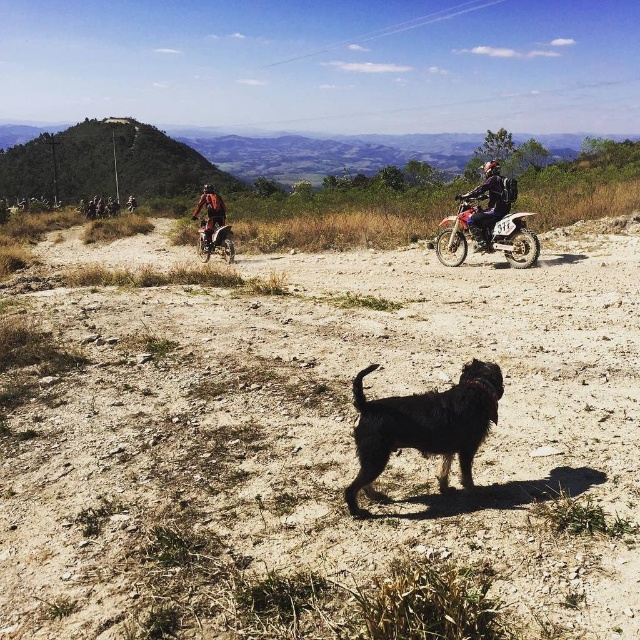
Between brown sandy dirt at center and green grassy hill at upper left, which one has more height?

green grassy hill at upper left is taller.

Is point (340, 554) positioned in front of point (1, 170)?

That is True.

Find the location of a particular element. brown sandy dirt at center is located at coordinates (321, 445).

Is metallic silver dirt bike at center-left wider than orange fabric jacket at upper left?

Yes, metallic silver dirt bike at center-left is wider than orange fabric jacket at upper left.

Who is shorter, metallic silver dirt bike at center-left or orange fabric jacket at upper left?

metallic silver dirt bike at center-left is shorter.

Between point (198, 248) and point (209, 227), which one is positioned in front?

Point (209, 227) is more forward.

Identify the location of metallic silver dirt bike at center-left. This screenshot has width=640, height=640. (214, 241).

Is orange matte dirt bike at right bigger than orange fabric jacket at upper left?

Indeed, orange matte dirt bike at right has a larger size compared to orange fabric jacket at upper left.

Between orange matte dirt bike at right and orange fabric jacket at upper left, which one is positioned lower?

Positioned lower is orange matte dirt bike at right.

Where is `orange matte dirt bike at right`? The height and width of the screenshot is (640, 640). orange matte dirt bike at right is located at coordinates (512, 240).